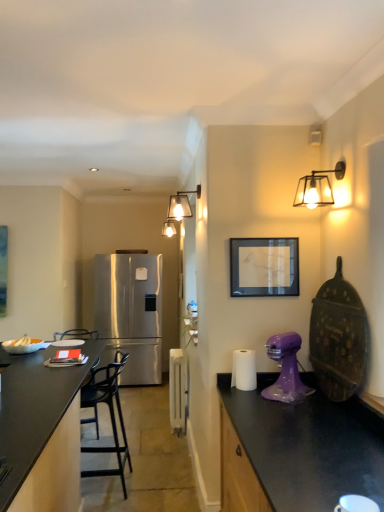
Question: Can you confirm if black matte countertop at left is wider than white glossy coffee cup at lower right?

Choices:
 (A) no
 (B) yes

Answer: (B)

Question: Does black matte countertop at left have a lesser width compared to white glossy coffee cup at lower right?

Choices:
 (A) no
 (B) yes

Answer: (A)

Question: Is black matte countertop at left further to camera compared to white glossy coffee cup at lower right?

Choices:
 (A) yes
 (B) no

Answer: (A)

Question: From the image's perspective, is black matte countertop at left on top of white glossy coffee cup at lower right?

Choices:
 (A) no
 (B) yes

Answer: (A)

Question: Is black matte countertop at left to the left of white glossy coffee cup at lower right from the viewer's perspective?

Choices:
 (A) no
 (B) yes

Answer: (B)

Question: Is black matte countertop at left with white glossy coffee cup at lower right?

Choices:
 (A) no
 (B) yes

Answer: (A)

Question: Can you confirm if white glossy radiator at center, placed as the first appliance when sorted from left to right, is positioned to the left of black matte countertop at left?

Choices:
 (A) yes
 (B) no

Answer: (B)

Question: Is white glossy radiator at center, arranged as the second appliance when viewed from the front, further to camera compared to black matte countertop at left?

Choices:
 (A) no
 (B) yes

Answer: (B)

Question: Is black matte countertop at left inside white glossy radiator at center, arranged as the second appliance when viewed from the front?

Choices:
 (A) yes
 (B) no

Answer: (B)

Question: Considering the relative sizes of white glossy radiator at center, arranged as the second appliance when viewed from the front, and black matte countertop at left in the image provided, is white glossy radiator at center, arranged as the second appliance when viewed from the front, thinner than black matte countertop at left?

Choices:
 (A) yes
 (B) no

Answer: (A)

Question: Is white glossy radiator at center, arranged as the second appliance when viewed from the front, smaller than black matte countertop at left?

Choices:
 (A) yes
 (B) no

Answer: (A)

Question: Is white glossy radiator at center, which is the second appliance in top-to-bottom order, beside black matte countertop at left?

Choices:
 (A) no
 (B) yes

Answer: (A)

Question: Considering the relative positions of satin stainless steel refrigerator at center and metallic glass sconce at upper right, which is the first light fixture in front-to-back order, in the image provided, is satin stainless steel refrigerator at center to the right of metallic glass sconce at upper right, which is the first light fixture in front-to-back order, from the viewer's perspective?

Choices:
 (A) yes
 (B) no

Answer: (B)